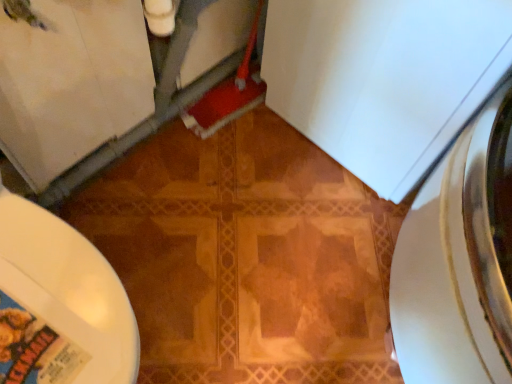
Where is `white glossy toilet at lower left`? The height and width of the screenshot is (384, 512). white glossy toilet at lower left is located at coordinates pos(60,304).

Describe the element at coordinates (60, 304) in the screenshot. I see `white glossy toilet at lower left` at that location.

Identify the location of white glossy toilet at lower left. Image resolution: width=512 pixels, height=384 pixels. point(60,304).